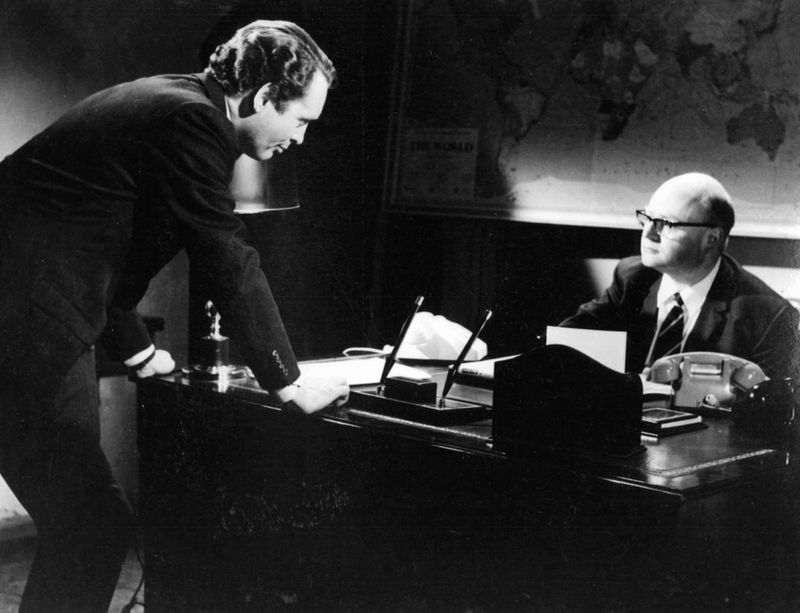
Image resolution: width=800 pixels, height=613 pixels. What are the coordinates of `desk` in the screenshot? It's located at (690, 450).